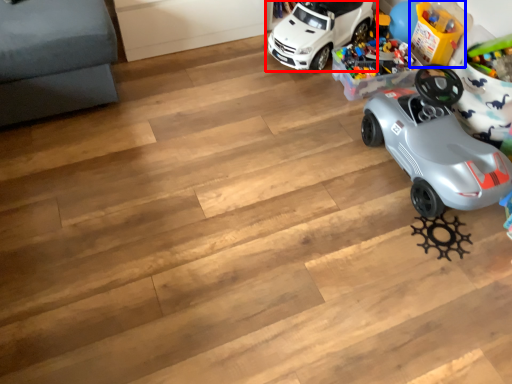
Question: Which point is closer to the camera, car (highlighted by a red box) or toy (highlighted by a blue box)?

Choices:
 (A) car
 (B) toy

Answer: (A)